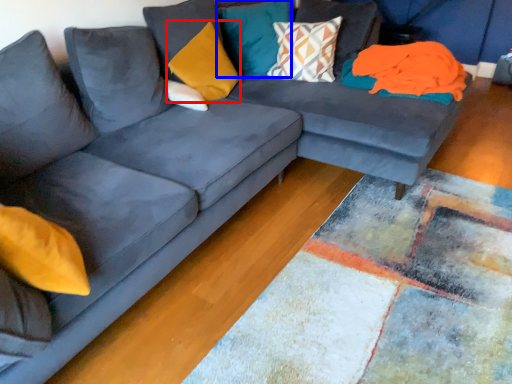
Question: Which point is further to the camera, pillow (highlighted by a red box) or pillow (highlighted by a blue box)?

Choices:
 (A) pillow
 (B) pillow

Answer: (B)